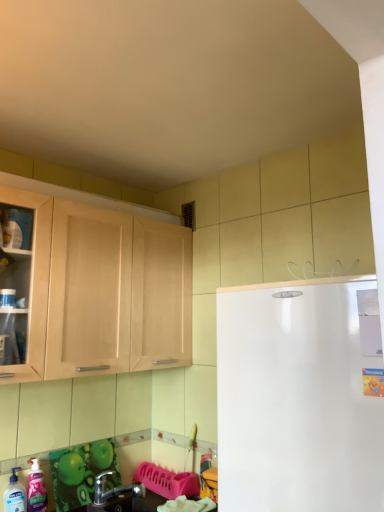
Question: Is pink glossy liquid soap at lower left, positioned as the 2th cleaning product in left-to-right order, inside green glossy countertop at lower left?

Choices:
 (A) no
 (B) yes

Answer: (A)

Question: Does green glossy countertop at lower left have a lesser height compared to pink glossy liquid soap at lower left, placed as the 1th cleaning product when sorted from right to left?

Choices:
 (A) no
 (B) yes

Answer: (B)

Question: Is green glossy countertop at lower left with pink glossy liquid soap at lower left, placed as the 1th cleaning product when sorted from right to left?

Choices:
 (A) yes
 (B) no

Answer: (B)

Question: Does green glossy countertop at lower left have a lesser width compared to pink glossy liquid soap at lower left, positioned as the 2th cleaning product in left-to-right order?

Choices:
 (A) no
 (B) yes

Answer: (A)

Question: Is green glossy countertop at lower left far away from pink glossy liquid soap at lower left, positioned as the 2th cleaning product in left-to-right order?

Choices:
 (A) no
 (B) yes

Answer: (A)

Question: From the image's perspective, is green glossy countertop at lower left under pink glossy liquid soap at lower left, placed as the 1th cleaning product when sorted from right to left?

Choices:
 (A) no
 (B) yes

Answer: (B)

Question: Can you confirm if green glossy countertop at lower left is bigger than light wood cabinet at left?

Choices:
 (A) no
 (B) yes

Answer: (A)

Question: Is green glossy countertop at lower left touching light wood cabinet at left?

Choices:
 (A) no
 (B) yes

Answer: (A)

Question: Considering the relative positions of green glossy countertop at lower left and light wood cabinet at left in the image provided, is green glossy countertop at lower left to the left of light wood cabinet at left from the viewer's perspective?

Choices:
 (A) no
 (B) yes

Answer: (A)

Question: From a real-world perspective, is green glossy countertop at lower left over light wood cabinet at left?

Choices:
 (A) no
 (B) yes

Answer: (A)

Question: Is light wood cabinet at left a part of green glossy countertop at lower left?

Choices:
 (A) no
 (B) yes

Answer: (A)

Question: Considering the relative sizes of green glossy countertop at lower left and light wood cabinet at left in the image provided, is green glossy countertop at lower left shorter than light wood cabinet at left?

Choices:
 (A) no
 (B) yes

Answer: (B)

Question: Is metallic silver faucet at lower left at the back of pink glossy liquid soap at lower left, positioned as the 2th cleaning product in left-to-right order?

Choices:
 (A) yes
 (B) no

Answer: (B)